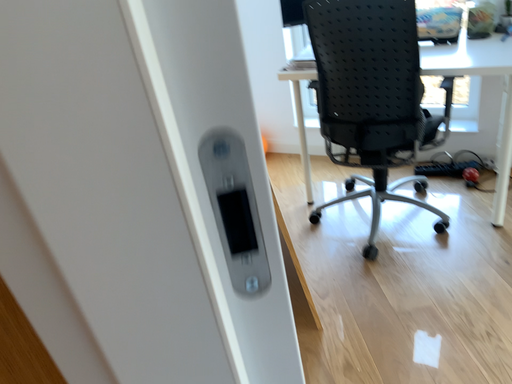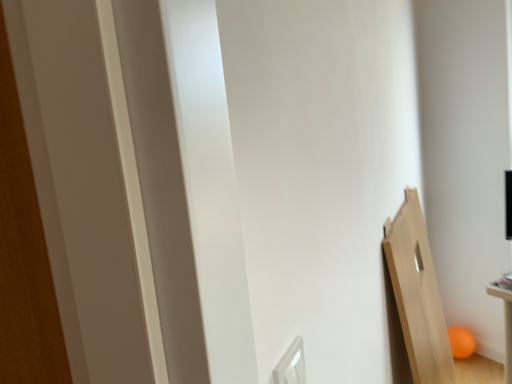
Question: How did the camera likely rotate when shooting the video?

Choices:
 (A) rotated downward
 (B) rotated upward

Answer: (B)